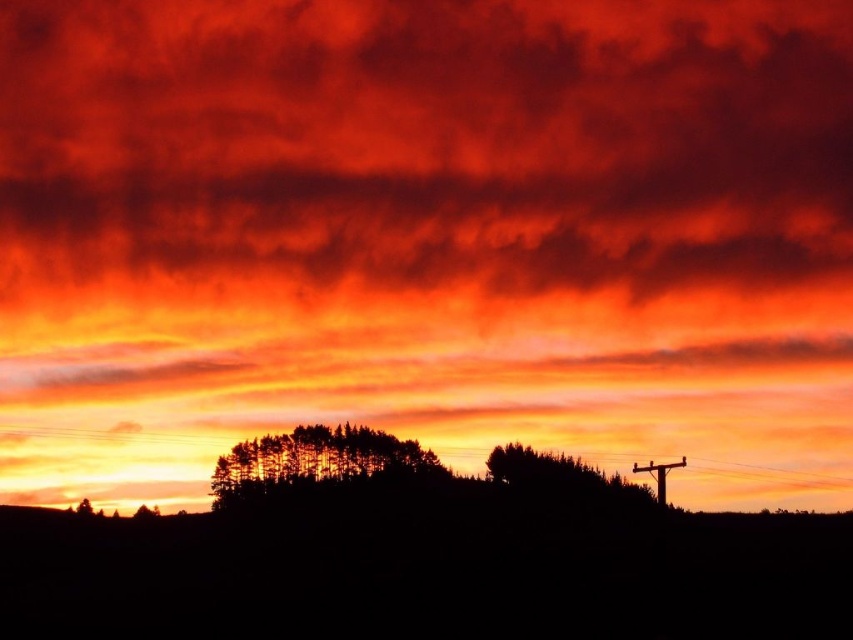
Question: Which object is the farthest from the silhouette wooden telegraph pole at right?

Choices:
 (A) silhouette tree at center
 (B) metallic wire at center

Answer: (B)

Question: Is silhouette tree at center above metallic wire at center?

Choices:
 (A) no
 (B) yes

Answer: (A)

Question: Which is nearer to the silhouette wooden telegraph pole at right?

Choices:
 (A) silhouette tree at center
 (B) metallic wire at center

Answer: (A)

Question: Which point is closer to the camera?

Choices:
 (A) metallic wire at center
 (B) silhouette tree at center

Answer: (B)

Question: Is silhouette tree at center to the right of metallic wire at center from the viewer's perspective?

Choices:
 (A) no
 (B) yes

Answer: (A)

Question: Is silhouette tree at center to the left of silhouette wooden telegraph pole at right from the viewer's perspective?

Choices:
 (A) yes
 (B) no

Answer: (A)